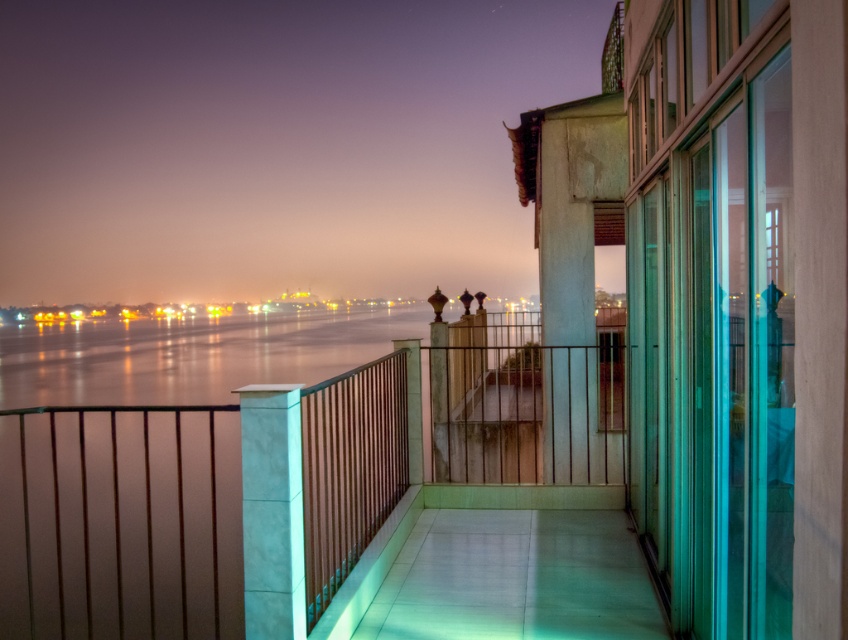
You are standing on the balcony and want to look at the glistening water at center. Which direction should you move to so that the white marble pillar at center no longer blocks your view?

Move to the left or right of the white marble pillar at center so that the glistening water at center becomes visible as it is located below the pillar.

You are standing on the balcony and want to know which object between the metallic railing at center and the glistening water at center takes up more visual space in the scene. Which one is bigger?

The metallic railing at center is larger in size than the glistening water at center, so the metallic railing at center takes up more visual space in the scene.

You are standing on the balcony and want to look at two points on the railing. The first point is at coordinates point (91, 380) and the second is at point (268, 461). Which point is closer to you?

Point (91, 380) is closer to you because it is further to the viewer than point (268, 461).